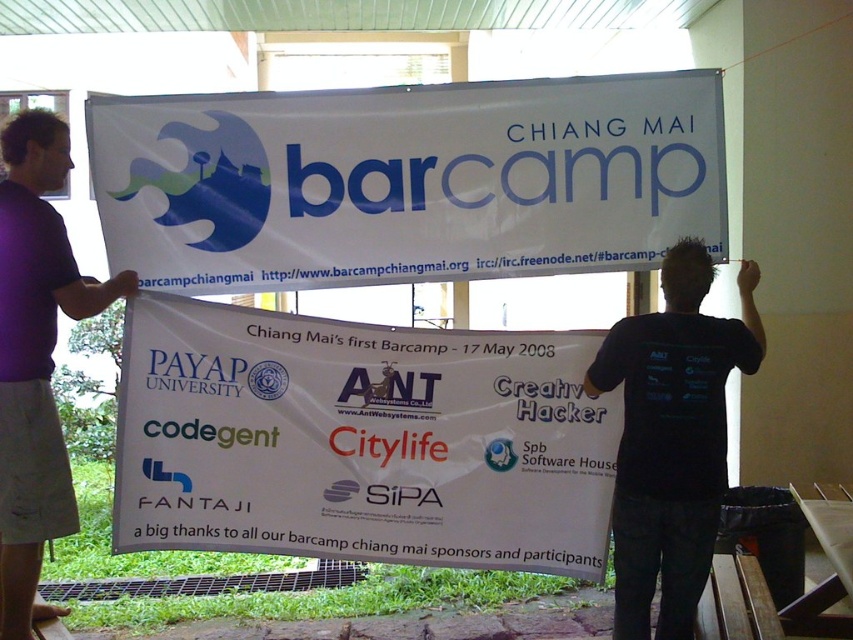
Between white paper banner at upper center and white paper banner at center, which one is positioned lower?

white paper banner at center is below.

In the scene shown: Is white paper banner at upper center to the right of white paper banner at center from the viewer's perspective?

Yes, white paper banner at upper center is to the right of white paper banner at center.

Find the location of a particular element. This screenshot has height=640, width=853. white paper banner at upper center is located at coordinates (407, 180).

Find the location of a particular element. white paper banner at upper center is located at coordinates tap(407, 180).

Is point (138, 109) positioned after point (646, 524)?

Yes, it is behind point (646, 524).

What do you see at coordinates (407, 180) in the screenshot? I see `white paper banner at upper center` at bounding box center [407, 180].

Is point (393, 237) positioned in front of point (670, 609)?

No.

The width and height of the screenshot is (853, 640). Identify the location of white paper banner at upper center. click(x=407, y=180).

Can you confirm if white paper banner at upper center is wider than purple fabric shirt at left?

Yes.

Which of these two, white paper banner at upper center or purple fabric shirt at left, stands taller?

Standing taller between the two is purple fabric shirt at left.

This screenshot has width=853, height=640. I want to click on white paper banner at upper center, so click(x=407, y=180).

Identify the location of white paper banner at upper center. (407, 180).